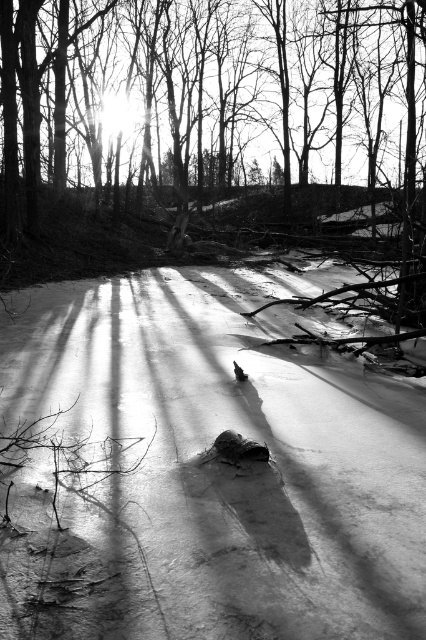
Can you confirm if white matte snow at center is positioned above silhouette bare tree at center?

No, white matte snow at center is not above silhouette bare tree at center.

Does white matte snow at center have a smaller size compared to silhouette bare tree at center?

Yes.

Find the location of a particular element. The height and width of the screenshot is (640, 426). white matte snow at center is located at coordinates (213, 468).

At what (x,y) coordinates should I click in order to perform the action: click on white matte snow at center. Please return your answer as a coordinate pair (x, y). Looking at the image, I should click on (x=213, y=468).